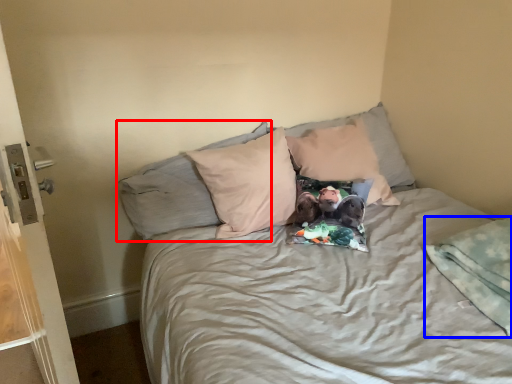
Question: Among these objects, which one is farthest to the camera, pillow (highlighted by a red box) or blanket (highlighted by a blue box)?

Choices:
 (A) pillow
 (B) blanket

Answer: (A)